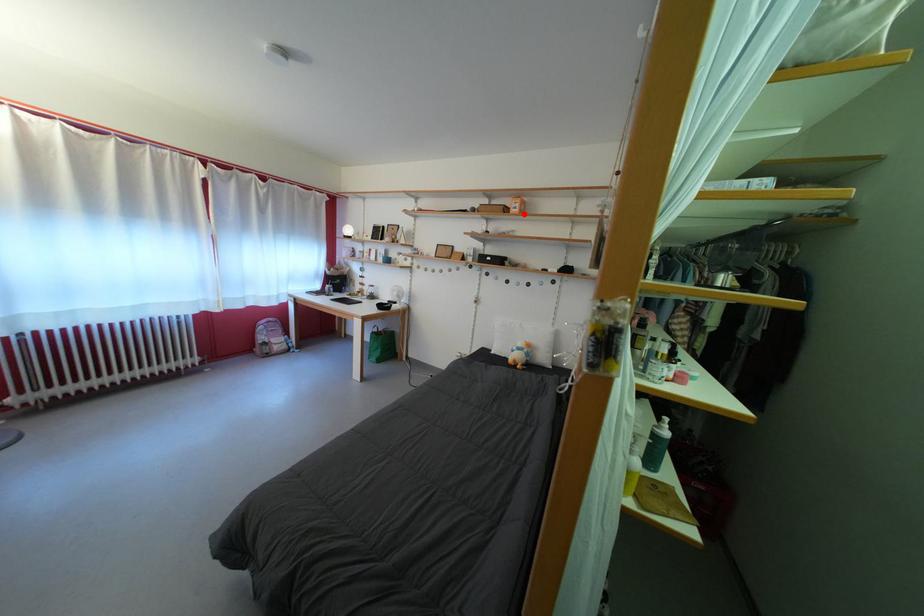
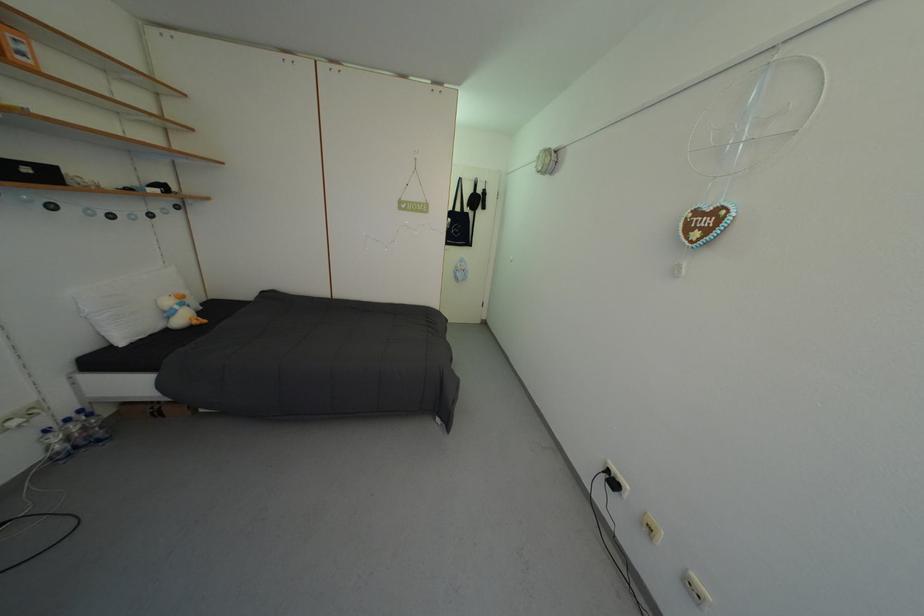
Question: I am providing you with two images of the same scene from different viewpoints. A red point is shown in image1. For the corresponding object point in image2, is it positioned nearer or farther from the camera?

Choices:
 (A) Nearer
 (B) Farther

Answer: (B)